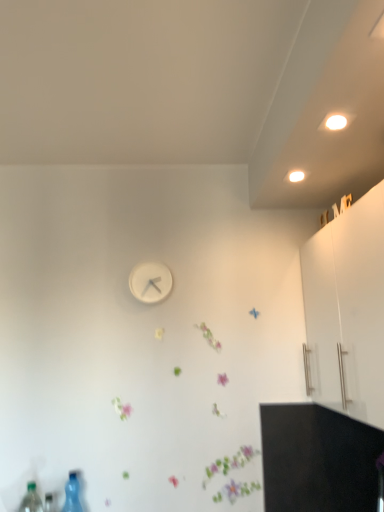
Question: Is transparent plastic bottle at lower left, the 1th bottle in the left-to-right sequence, at the right side of purple matte flower at center?

Choices:
 (A) yes
 (B) no

Answer: (B)

Question: Is transparent plastic bottle at lower left, marked as the 2th bottle in a right-to-left arrangement, next to purple matte flower at center?

Choices:
 (A) yes
 (B) no

Answer: (B)

Question: From a real-world perspective, is transparent plastic bottle at lower left, which ranks as the 1th bottle in front-to-back order, on purple matte flower at center?

Choices:
 (A) yes
 (B) no

Answer: (B)

Question: Does transparent plastic bottle at lower left, the 2th bottle positioned from the back, have a smaller size compared to purple matte flower at center?

Choices:
 (A) no
 (B) yes

Answer: (A)

Question: From the image's perspective, is transparent plastic bottle at lower left, which ranks as the 1th bottle in front-to-back order, below purple matte flower at center?

Choices:
 (A) no
 (B) yes

Answer: (B)

Question: Considering the relative positions of transparent plastic bottle at lower left, the 1th bottle in the left-to-right sequence, and purple matte flower at center in the image provided, is transparent plastic bottle at lower left, the 1th bottle in the left-to-right sequence, to the left of purple matte flower at center from the viewer's perspective?

Choices:
 (A) no
 (B) yes

Answer: (B)

Question: From the image's perspective, is transparent plastic bottle at lower left, the 2th bottle viewed from the left, on top of transparent plastic bottle at lower left, the 2th bottle positioned from the back?

Choices:
 (A) no
 (B) yes

Answer: (A)

Question: Is transparent plastic bottle at lower left, which appears as the first bottle when viewed from the right, taller than transparent plastic bottle at lower left, the 2th bottle positioned from the back?

Choices:
 (A) yes
 (B) no

Answer: (B)

Question: Is transparent plastic bottle at lower left, which appears as the first bottle when viewed from the right, located outside transparent plastic bottle at lower left, marked as the 2th bottle in a right-to-left arrangement?

Choices:
 (A) yes
 (B) no

Answer: (A)

Question: Is transparent plastic bottle at lower left, which is counted as the 1th bottle, starting from the back, turned away from transparent plastic bottle at lower left, the 2th bottle positioned from the back?

Choices:
 (A) no
 (B) yes

Answer: (A)

Question: Is transparent plastic bottle at lower left, which is counted as the 1th bottle, starting from the back, closer to the viewer compared to transparent plastic bottle at lower left, the 2th bottle positioned from the back?

Choices:
 (A) yes
 (B) no

Answer: (B)

Question: Is transparent plastic bottle at lower left, the second bottle viewed from the front, shorter than transparent plastic bottle at lower left, the 1th bottle in the left-to-right sequence?

Choices:
 (A) no
 (B) yes

Answer: (B)

Question: From a real-world perspective, is purple matte flower at center located higher than white matte clock at center?

Choices:
 (A) no
 (B) yes

Answer: (A)